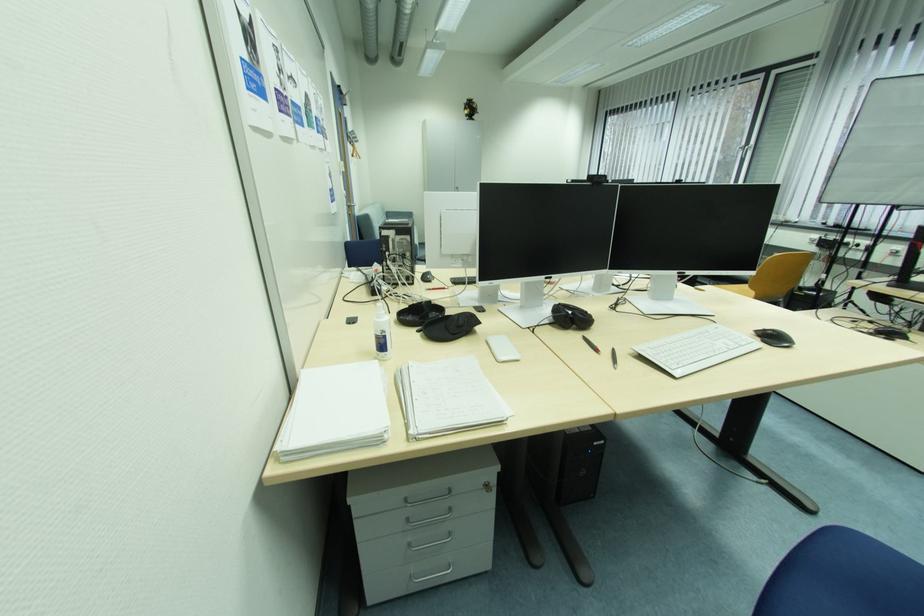
Find the location of `yellow chair sitting surface`. yellow chair sitting surface is located at coordinates (734, 284).